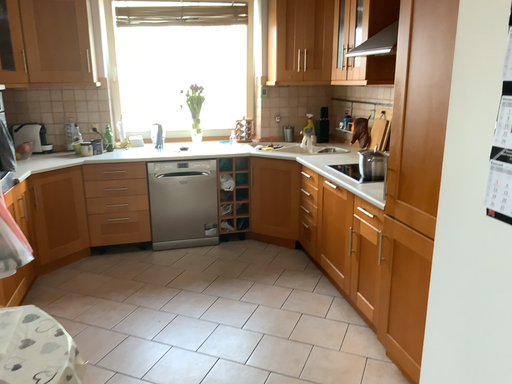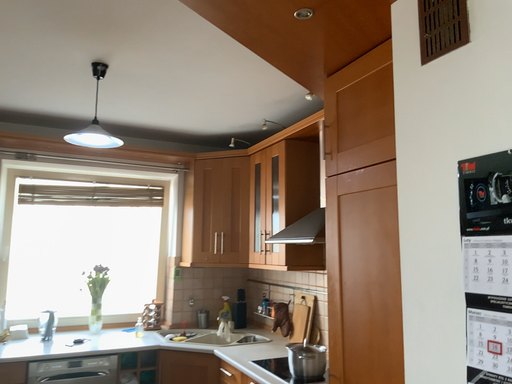
Question: How did the camera likely rotate when shooting the video?

Choices:
 (A) rotated downward
 (B) rotated upward

Answer: (B)